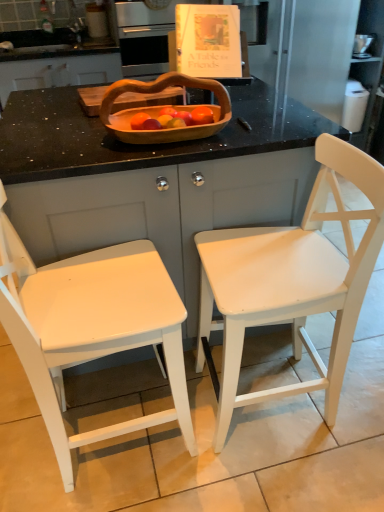
Question: Can you confirm if white painted wood chair at right, marked as the 1th chair in a right-to-left arrangement, is bigger than matte wood counter at center?

Choices:
 (A) yes
 (B) no

Answer: (B)

Question: Is white painted wood chair at right, the 2th chair positioned from the left, positioned in front of matte wood counter at center?

Choices:
 (A) yes
 (B) no

Answer: (A)

Question: Is white painted wood chair at right, the 2th chair positioned from the left, not inside matte wood counter at center?

Choices:
 (A) yes
 (B) no

Answer: (A)

Question: Is white painted wood chair at right, the 2th chair positioned from the left, with matte wood counter at center?

Choices:
 (A) yes
 (B) no

Answer: (B)

Question: Can you confirm if white painted wood chair at right, marked as the 1th chair in a right-to-left arrangement, is taller than matte wood counter at center?

Choices:
 (A) yes
 (B) no

Answer: (A)

Question: Is white painted wood chair at right, the 2th chair positioned from the left, at the left side of matte wood counter at center?

Choices:
 (A) no
 (B) yes

Answer: (A)

Question: Considering the relative sizes of white painted wood chair at left, which is the first chair in left-to-right order, and wooden cutting board at upper center in the image provided, is white painted wood chair at left, which is the first chair in left-to-right order, taller than wooden cutting board at upper center?

Choices:
 (A) yes
 (B) no

Answer: (A)

Question: Considering the relative sizes of white painted wood chair at left, which ranks as the 2th chair in right-to-left order, and wooden cutting board at upper center in the image provided, is white painted wood chair at left, which ranks as the 2th chair in right-to-left order, wider than wooden cutting board at upper center?

Choices:
 (A) no
 (B) yes

Answer: (B)

Question: From the image's perspective, is white painted wood chair at left, which is the first chair in left-to-right order, located beneath wooden cutting board at upper center?

Choices:
 (A) no
 (B) yes

Answer: (B)

Question: Is the depth of white painted wood chair at left, which ranks as the 2th chair in right-to-left order, less than that of wooden cutting board at upper center?

Choices:
 (A) no
 (B) yes

Answer: (B)

Question: From the image's perspective, is white painted wood chair at left, which is the first chair in left-to-right order, above wooden cutting board at upper center?

Choices:
 (A) yes
 (B) no

Answer: (B)

Question: Can you see white painted wood chair at left, which is the first chair in left-to-right order, touching wooden cutting board at upper center?

Choices:
 (A) yes
 (B) no

Answer: (B)

Question: Can you see wooden cutting board at upper center touching matte white book at upper center?

Choices:
 (A) no
 (B) yes

Answer: (A)